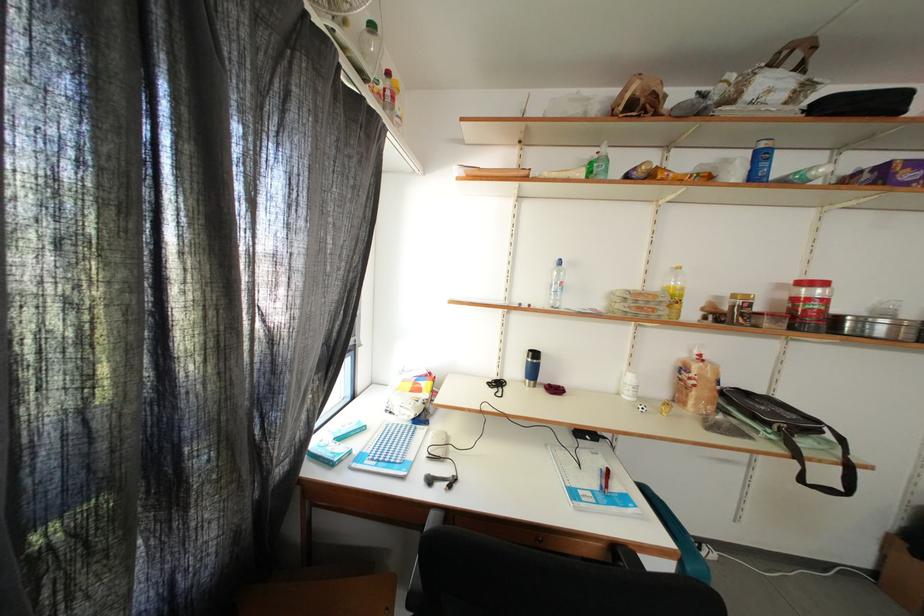
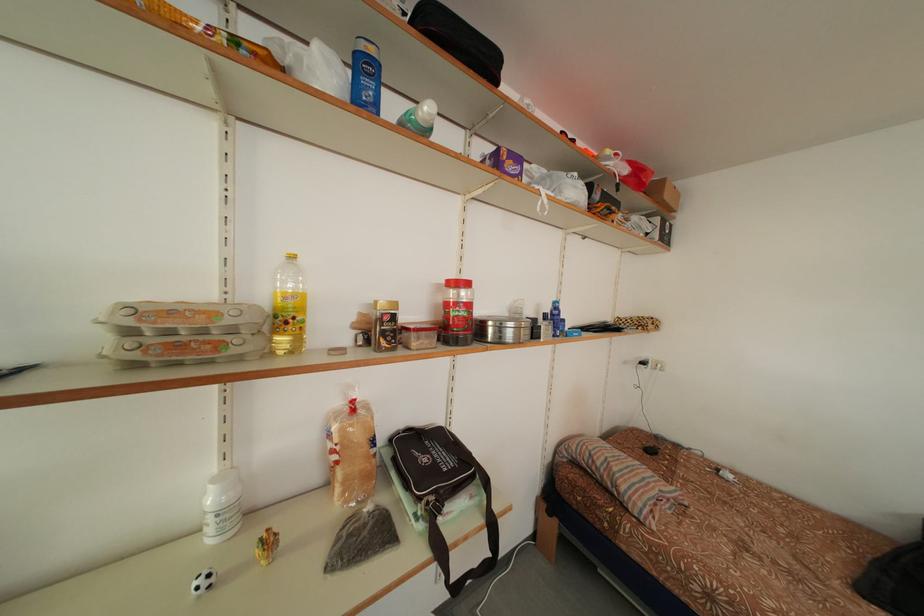
Find the pixel in the second image that matches [648,299] in the first image.

(178, 317)